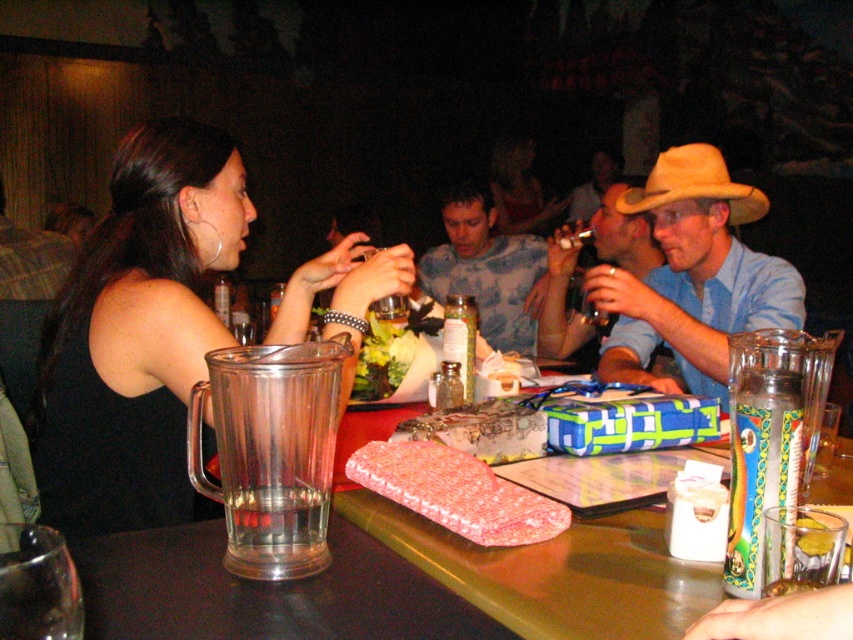
Question: Which of the following is the closest to the observer?

Choices:
 (A) pink fabric purse at table center
 (B) matte blue shirt at center
 (C) blue tie-dye shirt at center

Answer: (A)

Question: Does pink fabric purse at table center lie behind matte black dress at center?

Choices:
 (A) no
 (B) yes

Answer: (A)

Question: Does matte black dress at center appear under green leafy salad at center?

Choices:
 (A) no
 (B) yes

Answer: (A)

Question: Among these objects, which one is nearest to the camera?

Choices:
 (A) light blue shirt at center
 (B) blue tie-dye shirt at center
 (C) green leafy salad at center

Answer: (A)

Question: Among these points, which one is nearest to the camera?

Choices:
 (A) (426, 493)
 (B) (225, 515)

Answer: (B)

Question: Does light blue shirt at center appear on the right side of tan suede cowboy hat at right?

Choices:
 (A) yes
 (B) no

Answer: (B)